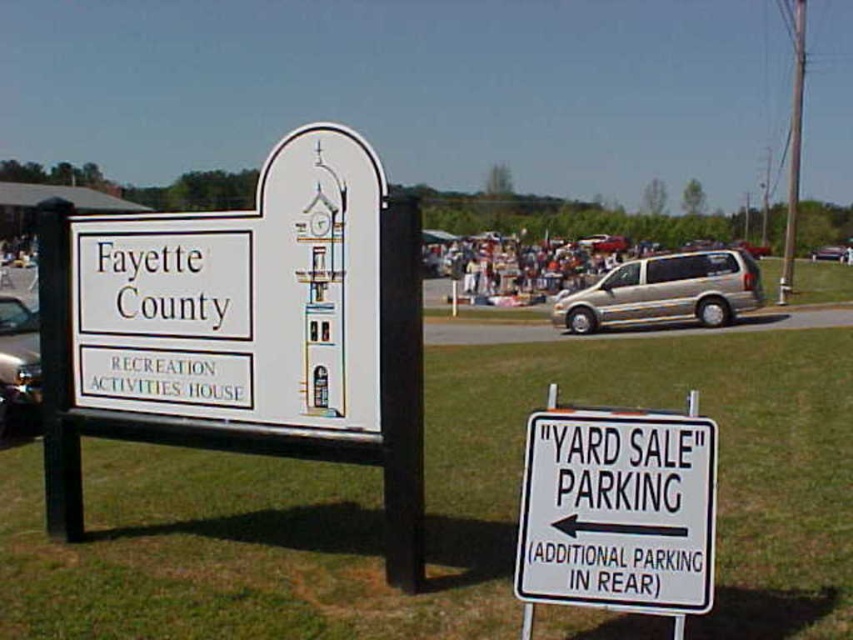
What is the relationship in height between the white plastic sign at center and the metallic silver van at center in the scene?

The white plastic sign at center is taller than the metallic silver van at center.

You are a delivery person who needs to park your metallic silver van at center as close as possible to the white plastic sign at center without blocking the sign. Given that the parking space is 25 feet long, can you park your van there?

The white plastic sign at center and metallic silver van at center are 25.16 feet apart. Since the parking space is only 25 feet long, the van cannot be parked close enough to the sign without exceeding the space limit. Therefore, it is not possible to park the metallic silver van at center within the 25 feet space while staying close to the white plastic sign at center.

You are at a community event and need to park your car. You see the green grass at lower center and the gold metallic minivan at right. Which area is more suitable for parking?

The gold metallic minivan at right is parked in a suitable area, while the green grass at lower center is not appropriate for parking since it is a grassy area and likely not designated for vehicle parking.